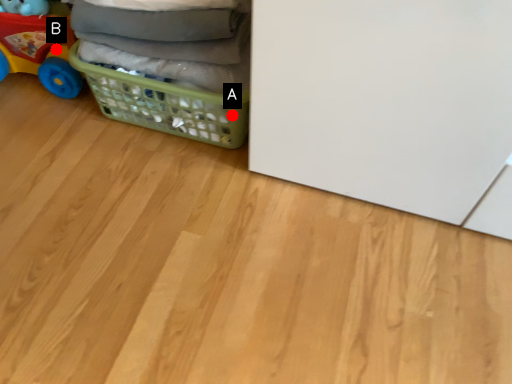
Question: Two points are circled on the image, labeled by A and B beside each circle. Which point is closer to the camera taking this photo?

Choices:
 (A) A is closer
 (B) B is closer

Answer: (A)